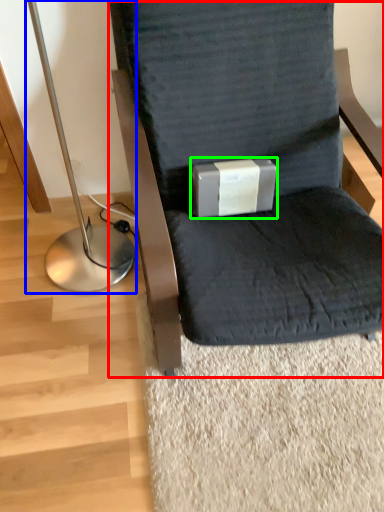
Question: Which object is the farthest from chair (highlighted by a red box)? Choose among these: bedside lamp (highlighted by a blue box) or box (highlighted by a green box).

Choices:
 (A) bedside lamp
 (B) box

Answer: (A)